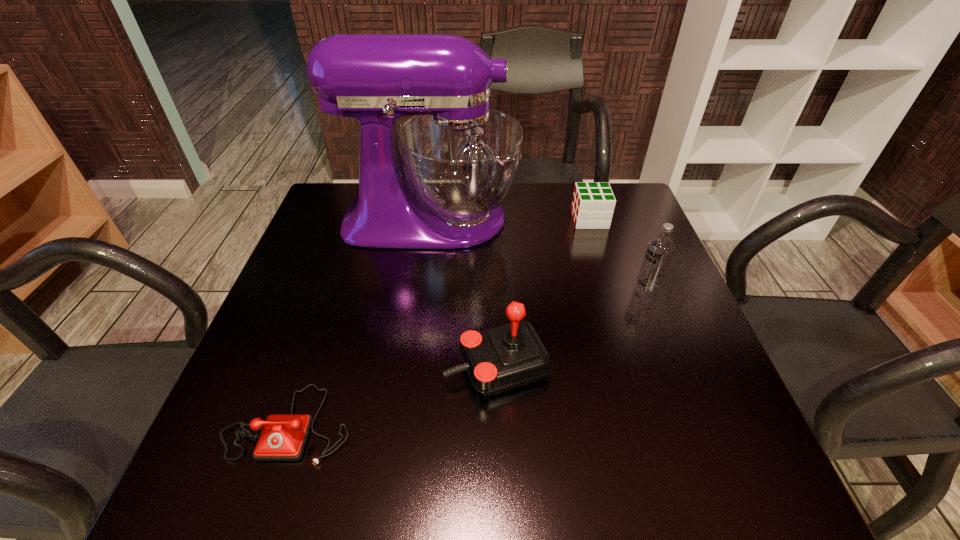
At what (x,y) coordinates should I click in order to perform the action: click on vodka positioned at the right edge. Please return your answer as a coordinate pair (x, y). Image resolution: width=960 pixels, height=540 pixels. Looking at the image, I should click on (660, 248).

This screenshot has width=960, height=540. In order to click on cube situated at the right edge in this screenshot , I will do `click(593, 204)`.

Locate an element on the screen. This screenshot has width=960, height=540. object located at the far left corner is located at coordinates (460, 159).

Find the location of a particular element. The width and height of the screenshot is (960, 540). object at the near left corner is located at coordinates (283, 438).

Where is `object that is at the far right corner`? The width and height of the screenshot is (960, 540). object that is at the far right corner is located at coordinates (593, 204).

This screenshot has width=960, height=540. I want to click on vacant space at the far edge of the desktop, so click(x=507, y=227).

This screenshot has height=540, width=960. What are the coordinates of `vacant point at the near edge` in the screenshot? It's located at (593, 472).

Find the location of a particular element. This screenshot has width=960, height=540. vacant space at the left edge of the desktop is located at coordinates (308, 312).

In the image, there is a desktop. In order to click on vacant space at the right edge in this screenshot , I will do (x=635, y=370).

Identify the location of free spot at the far right corner of the desktop. The height and width of the screenshot is (540, 960). point(622,232).